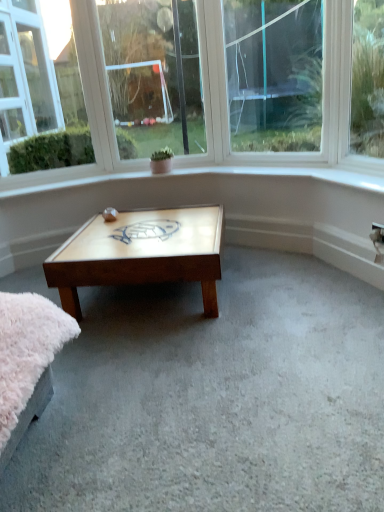
Question: Is clear glass window at upper center, which is the second window in left-to-right order, wider or thinner than wooden turtle design at center?

Choices:
 (A) thin
 (B) wide

Answer: (A)

Question: Is clear glass window at upper center, positioned as the second window in right-to-left order, in front of or behind wooden turtle design at center in the image?

Choices:
 (A) behind
 (B) front

Answer: (A)

Question: Which object is positioned farthest from the clear glass window at upper left, the 1th window when ordered from left to right?

Choices:
 (A) clear glass window at upper center, the third window when ordered from left to right
 (B) wooden turtle at center
 (C) clear glass window at upper center, positioned as the second window in right-to-left order
 (D) wooden turtle design at center

Answer: (A)

Question: Estimate the real-world distances between objects in this image. Which object is closer to the wooden turtle at center?

Choices:
 (A) clear glass window at upper left, placed as the 3th window when sorted from right to left
 (B) clear glass window at upper center, the 1th window when ordered from right to left
 (C) clear glass window at upper center, positioned as the second window in right-to-left order
 (D) wooden turtle design at center

Answer: (D)